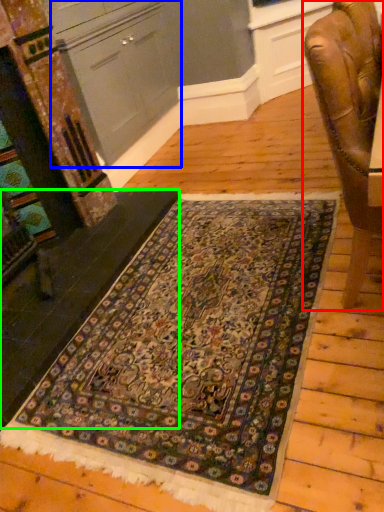
Question: Considering the real-world distances, which object is closest to chair (highlighted by a red box)? cabinetry (highlighted by a blue box) or stair (highlighted by a green box).

Choices:
 (A) cabinetry
 (B) stair

Answer: (B)